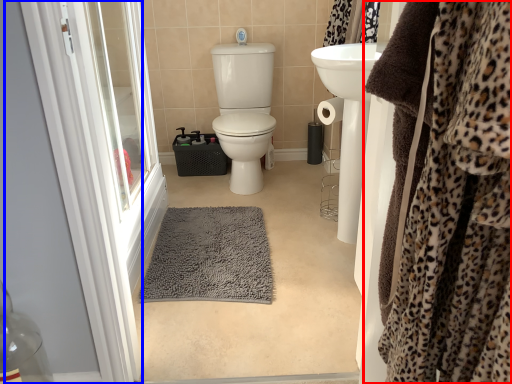
Question: Which object is closer to the camera taking this photo, clothing (highlighted by a red box) or screen door (highlighted by a blue box)?

Choices:
 (A) clothing
 (B) screen door

Answer: (A)